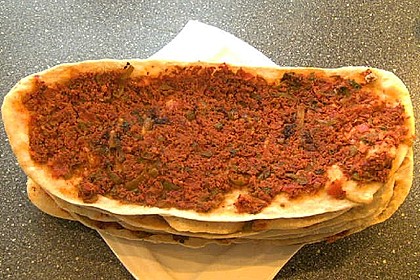
The width and height of the screenshot is (420, 280). In order to click on surface in this screenshot , I will do `click(353, 13)`.